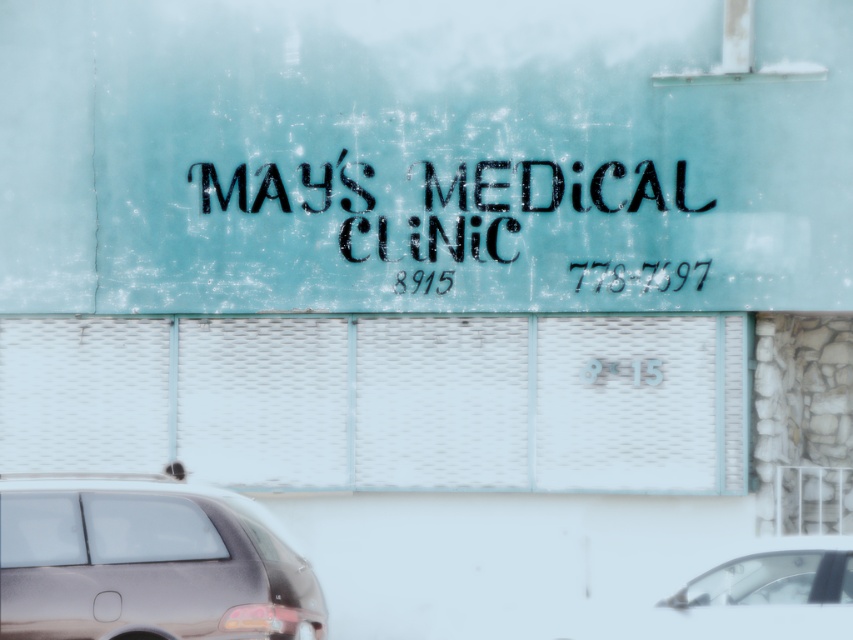
Question: Can you confirm if shiny metallic car at lower left is positioned above black stenciled text at center?

Choices:
 (A) yes
 (B) no

Answer: (B)

Question: In this image, where is shiny metallic car at lower left located relative to metallic silver car at lower right?

Choices:
 (A) below
 (B) above

Answer: (B)

Question: Is black stenciled text at center behind metallic silver car at lower right?

Choices:
 (A) yes
 (B) no

Answer: (A)

Question: Which of the following is the closest to the observer?

Choices:
 (A) (368, 256)
 (B) (723, 586)
 (C) (189, 552)

Answer: (C)

Question: Among these points, which one is nearest to the camera?

Choices:
 (A) (828, 568)
 (B) (25, 612)
 (C) (543, 195)

Answer: (B)

Question: Which point is closer to the camera?

Choices:
 (A) (831, 580)
 (B) (671, 182)
 (C) (100, 579)

Answer: (A)